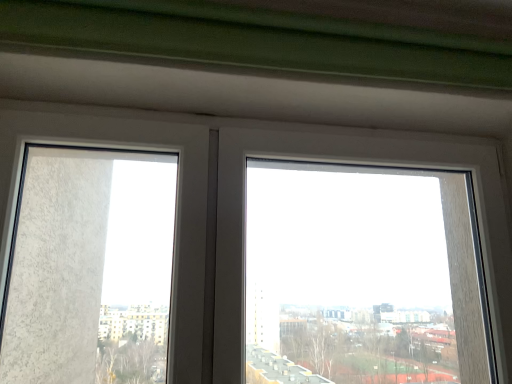
Where is `transparent glass window at center`? This screenshot has width=512, height=384. transparent glass window at center is located at coordinates (362, 162).

What do you see at coordinates (362, 162) in the screenshot? I see `transparent glass window at center` at bounding box center [362, 162].

Measure the distance between transparent glass window at center and camera.

They are 96.82 centimeters apart.

The image size is (512, 384). I want to click on transparent glass window at center, so click(362, 162).